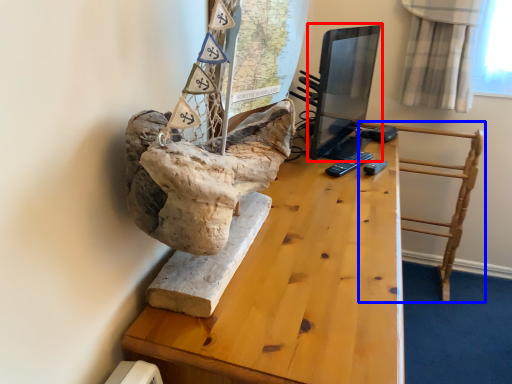
Question: Which object is further to the camera taking this photo, computer monitor (highlighted by a red box) or furniture (highlighted by a blue box)?

Choices:
 (A) computer monitor
 (B) furniture

Answer: (B)